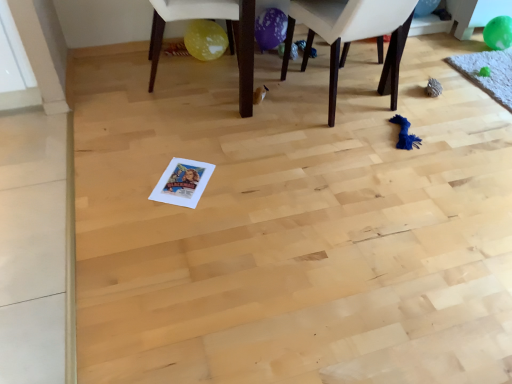
Question: From a real-world perspective, is dark brown wooden chair at center, placed as the 1th chair when sorted from right to left, physically located above or below yellow matte balloon under chair at center, positioned as the first chair in left-to-right order?

Choices:
 (A) above
 (B) below

Answer: (A)

Question: Is dark brown wooden chair at center, placed as the 1th chair when sorted from right to left, in front of or behind yellow matte balloon under chair at center, the 2th chair positioned from the right, in the image?

Choices:
 (A) behind
 (B) front

Answer: (B)

Question: Based on their relative distances, which object is nearer to the green rubber balloon at upper right, placed as the first balloon when sorted from right to left?

Choices:
 (A) yellow matte balloon under chair at center, the 2th chair positioned from the right
 (B) dark brown wooden chair at center, positioned as the 2th chair in left-to-right order
 (C) green rubber balloon at upper right, marked as the first balloon in a left-to-right arrangement

Answer: (C)

Question: Estimate the real-world distances between objects in this image. Which object is closer to the green rubber balloon at upper right, which appears as the first balloon when viewed from the top?

Choices:
 (A) dark brown wooden chair at center, positioned as the 2th chair in left-to-right order
 (B) green rubber balloon at upper right, which is counted as the 1th balloon, starting from the bottom
 (C) yellow matte balloon under chair at center, the 2th chair positioned from the right

Answer: (B)